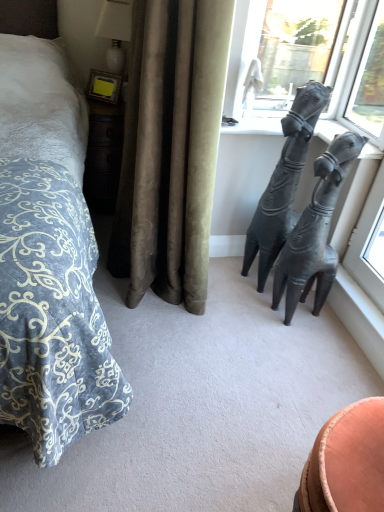
Image resolution: width=384 pixels, height=512 pixels. In order to click on vacant region to the left of black matte sculpture at right, which is the 2th statue (sculpture) from right to left in this screenshot , I will do `click(223, 276)`.